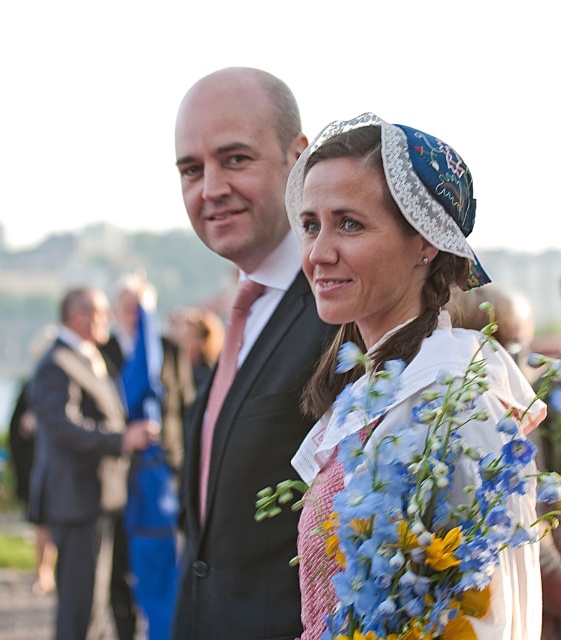
Measure the distance between matte black suit at center and camera.

They are 9.20 meters apart.

The width and height of the screenshot is (561, 640). What do you see at coordinates (245, 358) in the screenshot?
I see `matte black suit at center` at bounding box center [245, 358].

Between point (195, 592) and point (76, 625), which one is positioned in front?

Positioned in front is point (195, 592).

At what (x,y) coordinates should I click in order to perform the action: click on matte black suit at center. Please return your answer as a coordinate pair (x, y). This screenshot has height=640, width=561. Looking at the image, I should click on (245, 358).

Which is more to the left, embroidered fabric hat at center or dark gray suit at left?

Positioned to the left is dark gray suit at left.

Is embroidered fabric hat at center positioned before dark gray suit at left?

That is True.

Does point (434, 173) come in front of point (89, 429)?

Yes, it is in front of point (89, 429).

Locate an element on the screen. The width and height of the screenshot is (561, 640). embroidered fabric hat at center is located at coordinates (374, 292).

Who is more distant from viewer, (274, 164) or (484, 275)?

Positioned behind is point (274, 164).

Who is shorter, matte black suit at center or embroidered fabric hat at center?

embroidered fabric hat at center is shorter.

Identify the location of matte black suit at center. Image resolution: width=561 pixels, height=640 pixels. (245, 358).